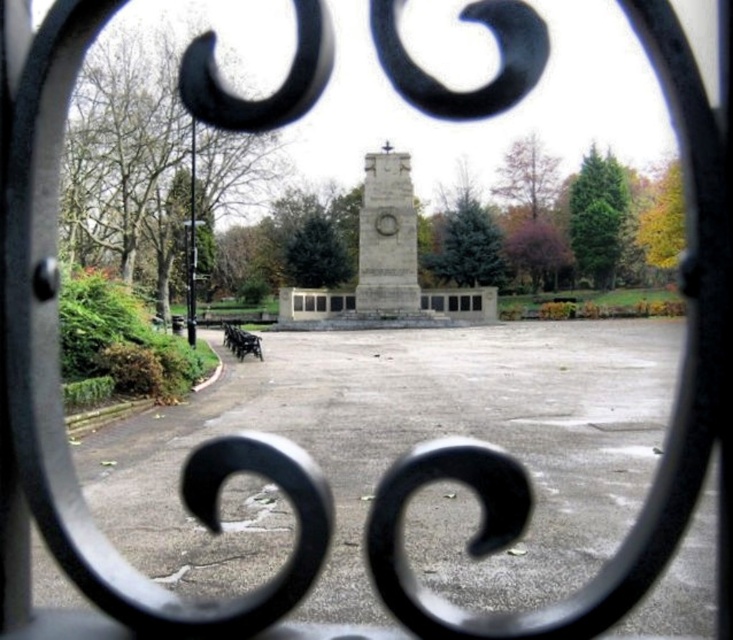
You are a photographer standing in front of the gray concrete parking lot at center and the granite stone monument at center. You want to take a photo that includes both objects in the frame. Which object should you focus on to ensure both are visible?

You should focus on the granite stone monument at center because the gray concrete parking lot at center is positioned under it, so by centering the monument in your viewfinder, the parking lot will naturally be included below it.

You are planning to organize a small event in the area shown in the image. You need to set up a 10m long stage. Given the gray concrete parking lot at center and the granite stone monument at center, which location would be more suitable for the stage based on their widths?

The gray concrete parking lot at center is wider than the granite stone monument at center, so the gray concrete parking lot at center would be more suitable for setting up a 10m long stage due to its greater width.